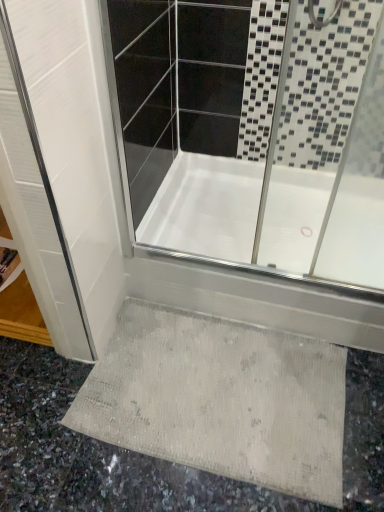
Where is `empty space that is ontop of beige textured bath mat at lower center`? The height and width of the screenshot is (512, 384). empty space that is ontop of beige textured bath mat at lower center is located at coordinates (204, 381).